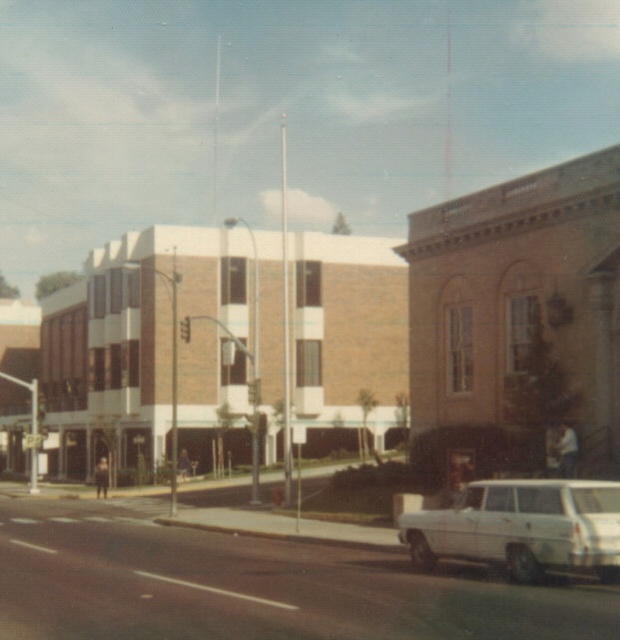
You are a delivery driver approaching the white matte station wagon at lower right and need to deliver a package to the brick building at center. Based on the scene, can you determine if you can drive directly from the wagon to the building without needing to go around?

The brick building at center is above the white matte station wagon at lower right, meaning it is positioned higher up in the image. Since the building is elevated relative to the wagon, you would need to drive upwards towards it, but there is no indication of a road or path connecting them directly. Therefore, you would likely need to go around via the visible road in the foreground.

You are standing at the edge of the road where the white car is parked on the right. Which direction should you walk to reach the brick building at center?

The brick building at center is located at point (466,323), so you should walk towards the center of the image to reach it.

You are a delivery driver who needs to park your vehicle on the right side of the road. There is a brick building at center and a white matte station wagon at lower right in the image. Which object is closer to the parking spot you want to reach?

The white matte station wagon at lower right is closer to the parking spot on the right side of the road because it is positioned to the right of the brick building at center.